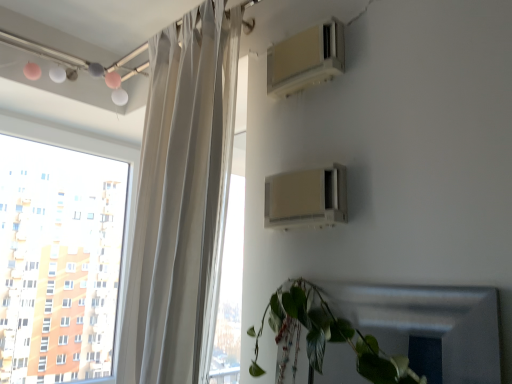
Question: Considering the relative positions of transparent glass window at upper left and beige plastic air conditioner at upper right, the second air conditioning viewed from the top, in the image provided, is transparent glass window at upper left to the right of beige plastic air conditioner at upper right, the second air conditioning viewed from the top, from the viewer's perspective?

Choices:
 (A) no
 (B) yes

Answer: (A)

Question: Is transparent glass window at upper left with beige plastic air conditioner at upper right, which ranks as the first air conditioning in bottom-to-top order?

Choices:
 (A) yes
 (B) no

Answer: (B)

Question: From a real-world perspective, does transparent glass window at upper left sit lower than beige plastic air conditioner at upper right, the second air conditioning viewed from the top?

Choices:
 (A) yes
 (B) no

Answer: (A)

Question: Is transparent glass window at upper left closer to camera compared to beige plastic air conditioner at upper right, the second air conditioning viewed from the top?

Choices:
 (A) no
 (B) yes

Answer: (A)

Question: Does transparent glass window at upper left have a lesser height compared to beige plastic air conditioner at upper right, the second air conditioning viewed from the top?

Choices:
 (A) yes
 (B) no

Answer: (B)

Question: Is point (287, 56) positioned closer to the camera than point (56, 178)?

Choices:
 (A) farther
 (B) closer

Answer: (B)

Question: From a real-world perspective, is beige plastic air conditioner at upper center, the 1th air conditioning in the top-to-bottom sequence, physically located above or below transparent glass window at upper left?

Choices:
 (A) below
 (B) above

Answer: (B)

Question: Would you say beige plastic air conditioner at upper center, which is counted as the 2th air conditioning, starting from the bottom, is inside or outside transparent glass window at upper left?

Choices:
 (A) outside
 (B) inside

Answer: (A)

Question: From their relative heights in the image, would you say beige plastic air conditioner at upper center, the 1th air conditioning in the top-to-bottom sequence, is taller or shorter than transparent glass window at upper left?

Choices:
 (A) short
 (B) tall

Answer: (A)

Question: Is green matte leafy plant at lower right bigger or smaller than transparent glass window at upper left?

Choices:
 (A) big
 (B) small

Answer: (B)

Question: Is green matte leafy plant at lower right situated inside transparent glass window at upper left or outside?

Choices:
 (A) inside
 (B) outside

Answer: (B)

Question: From a real-world perspective, is green matte leafy plant at lower right above or below transparent glass window at upper left?

Choices:
 (A) below
 (B) above

Answer: (A)

Question: In the image, is green matte leafy plant at lower right positioned in front of or behind transparent glass window at upper left?

Choices:
 (A) behind
 (B) front

Answer: (B)

Question: Relative to white sheer curtain at left, is beige plastic air conditioner at upper center, which is counted as the 2th air conditioning, starting from the bottom, in front or behind?

Choices:
 (A) front
 (B) behind

Answer: (B)

Question: Would you say beige plastic air conditioner at upper center, which is counted as the 2th air conditioning, starting from the bottom, is inside or outside white sheer curtain at left?

Choices:
 (A) inside
 (B) outside

Answer: (B)